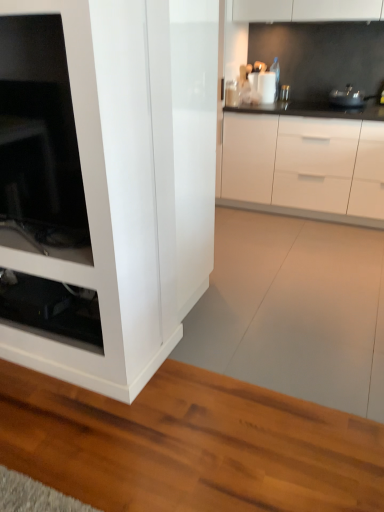
Question: Is white glossy cabinet at center shorter than white glossy container at upper center, arranged as the 2th appliance when viewed from the right?

Choices:
 (A) no
 (B) yes

Answer: (A)

Question: Can you confirm if white glossy cabinet at center is positioned to the right of white glossy container at upper center, arranged as the 2th appliance when viewed from the right?

Choices:
 (A) no
 (B) yes

Answer: (B)

Question: From the image's perspective, would you say white glossy cabinet at center is shown under white glossy container at upper center, arranged as the 2th appliance when viewed from the right?

Choices:
 (A) yes
 (B) no

Answer: (A)

Question: Is white glossy container at upper center, arranged as the 2th appliance when viewed from the right, surrounded by white glossy cabinet at center?

Choices:
 (A) no
 (B) yes

Answer: (A)

Question: Is white glossy cabinet at center positioned in front of white glossy container at upper center, arranged as the 2th appliance when viewed from the right?

Choices:
 (A) no
 (B) yes

Answer: (B)

Question: Could you tell me if white glossy cabinet at center is turned towards white glossy container at upper center, arranged as the 2th appliance when viewed from the right?

Choices:
 (A) yes
 (B) no

Answer: (B)

Question: Is white glossy cabinet at center surrounded by metallic silver pot at upper right, which is the 2th appliance in left-to-right order?

Choices:
 (A) yes
 (B) no

Answer: (B)

Question: Is metallic silver pot at upper right, the 1th appliance viewed from the right, positioned before white glossy cabinet at center?

Choices:
 (A) no
 (B) yes

Answer: (A)

Question: Is there a large distance between metallic silver pot at upper right, which is the 2th appliance in left-to-right order, and white glossy cabinet at center?

Choices:
 (A) yes
 (B) no

Answer: (B)

Question: Does metallic silver pot at upper right, which is the 2th appliance in left-to-right order, have a greater height compared to white glossy cabinet at center?

Choices:
 (A) no
 (B) yes

Answer: (A)

Question: From a real-world perspective, is metallic silver pot at upper right, which is the 2th appliance in left-to-right order, physically above white glossy cabinet at center?

Choices:
 (A) yes
 (B) no

Answer: (A)

Question: Is metallic silver pot at upper right, the 1th appliance viewed from the right, positioned with its back to white glossy cabinet at center?

Choices:
 (A) no
 (B) yes

Answer: (A)

Question: Would you say white glossy container at upper center, arranged as the 2th appliance when viewed from the right, contains white glossy cabinet at center?

Choices:
 (A) no
 (B) yes

Answer: (A)